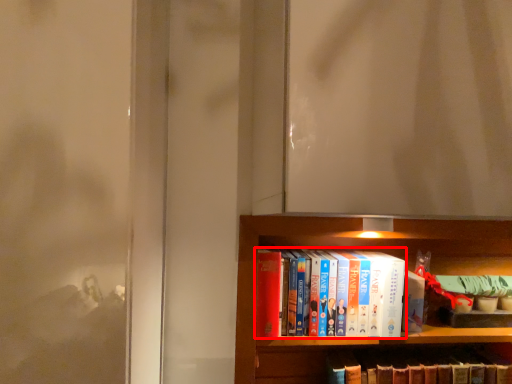
Question: From the image's perspective, what is the correct spatial positioning of book (annotated by the red box) in reference to book?

Choices:
 (A) above
 (B) below

Answer: (A)